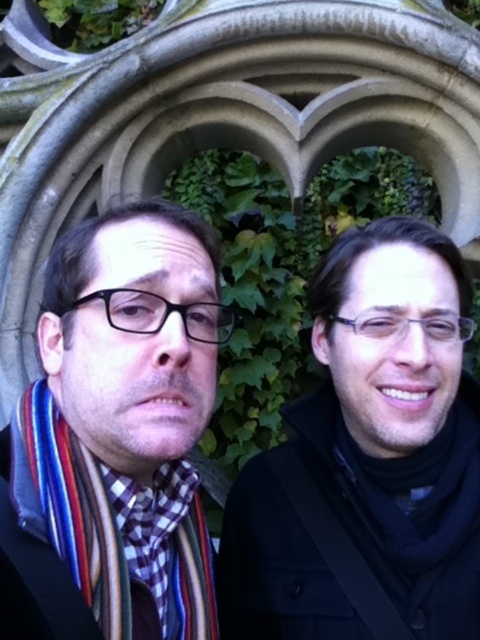
Who is shorter, black matte jacket at right or multicolored scarf at left?

Standing shorter between the two is multicolored scarf at left.

Is point (334, 394) positioned behind point (44, 387)?

Yes, it is behind point (44, 387).

Is point (468, 497) closer to camera compared to point (204, 346)?

No, it is not.

You are a GUI agent. You are given a task and a screenshot of the screen. Output one action in this format:
    pyautogui.click(x=<x>, y=<y>)
    Task: Click on the black matte jacket at right
    The image size is (480, 640).
    Given the screenshot: What is the action you would take?
    pyautogui.click(x=369, y=456)